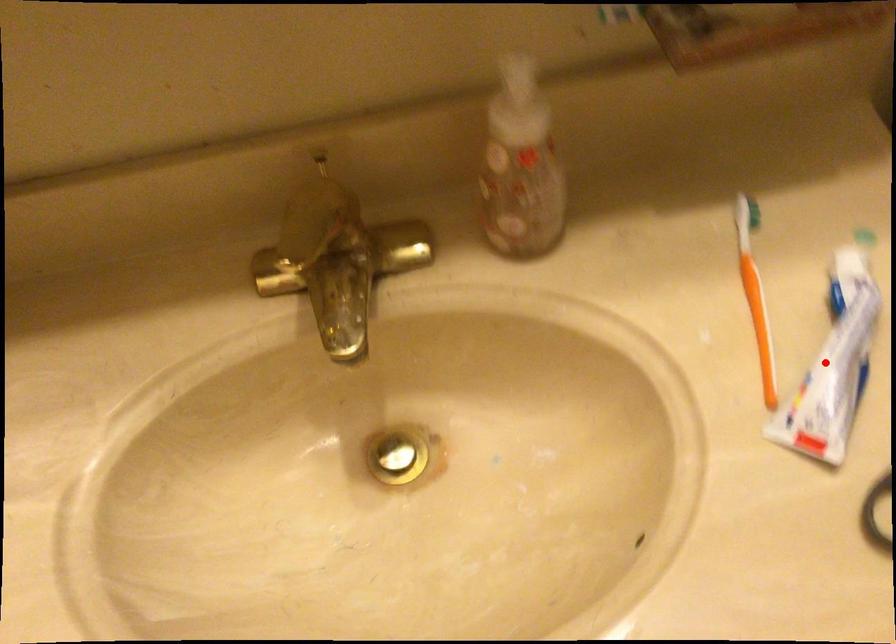
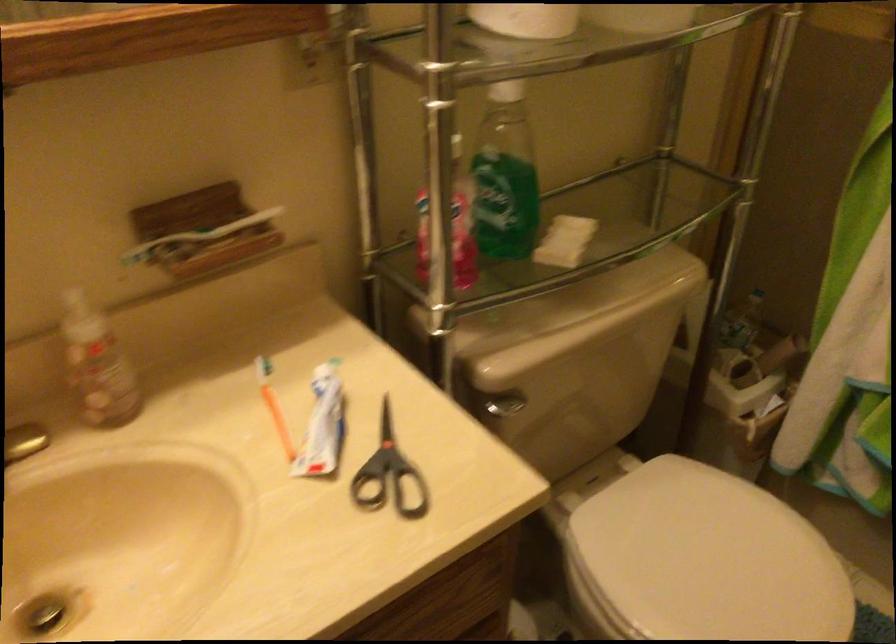
Question: I am providing you with two images of the same scene from different viewpoints. Given a red point in image1, look at the same physical point in image2. Is it:

Choices:
 (A) Closer to the viewpoint
 (B) Farther from the viewpoint

Answer: (B)